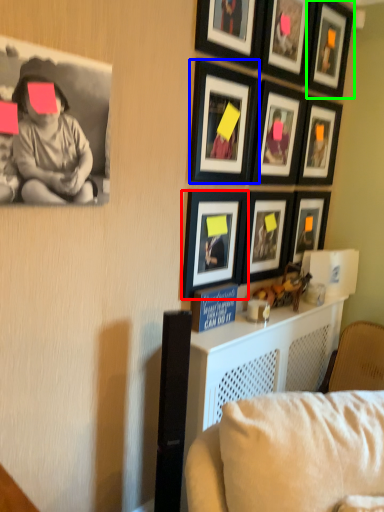
Question: Estimate the real-world distances between objects in this image. Which object is closer to picture frame (highlighted by a red box), picture frame (highlighted by a blue box) or picture frame (highlighted by a green box)?

Choices:
 (A) picture frame
 (B) picture frame

Answer: (A)